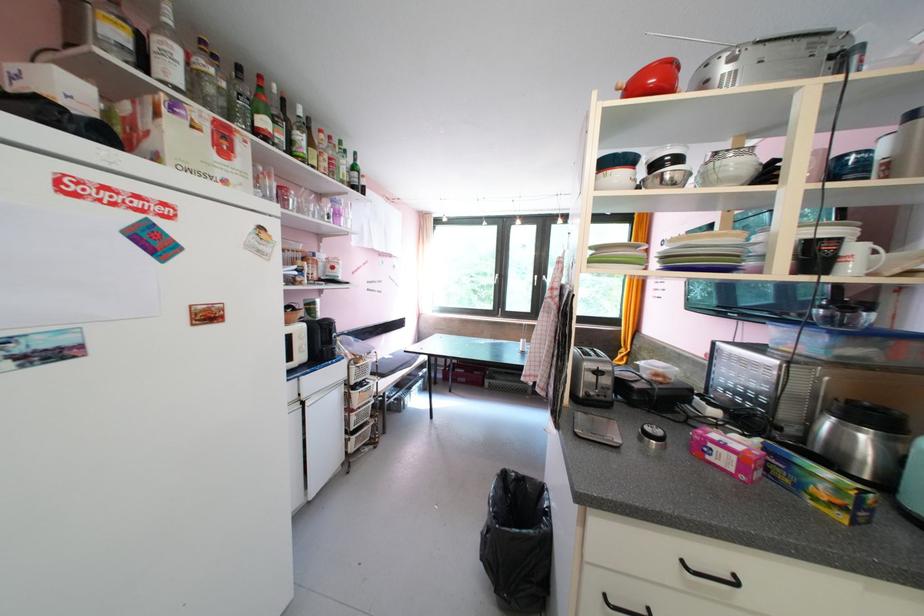
Where would you lift the green cardboard box? Please return your answer as a coordinate pair (x, y).

(820, 485)